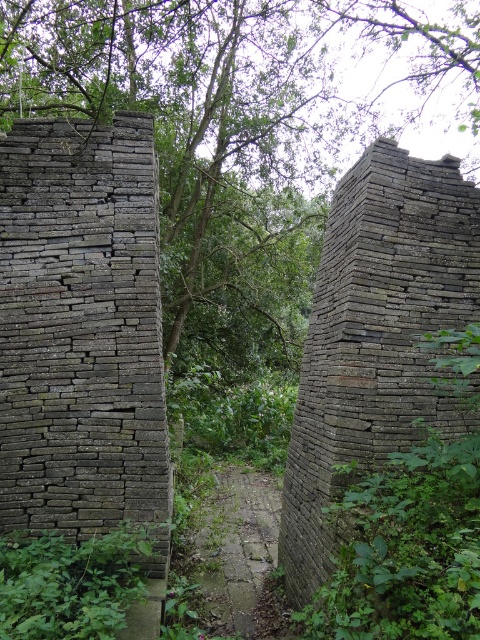
You are a hiker trying to navigate through the narrow path between the two structures. You notice the green leafy tree at center and the weathered stone wall at left. Which object is positioned higher in the scene?

The green leafy tree at center is located above the weathered stone wall at left, so it is positioned higher in the scene.